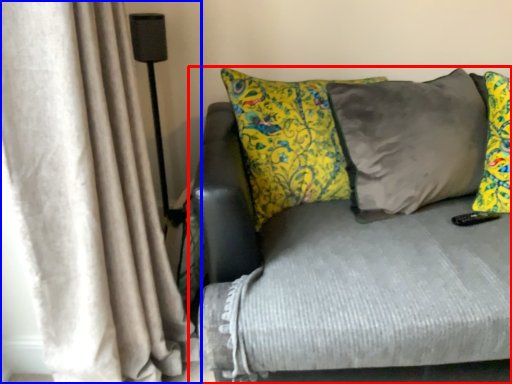
Question: Which object is closer to the camera taking this photo, studio couch (highlighted by a red box) or curtain (highlighted by a blue box)?

Choices:
 (A) studio couch
 (B) curtain

Answer: (B)